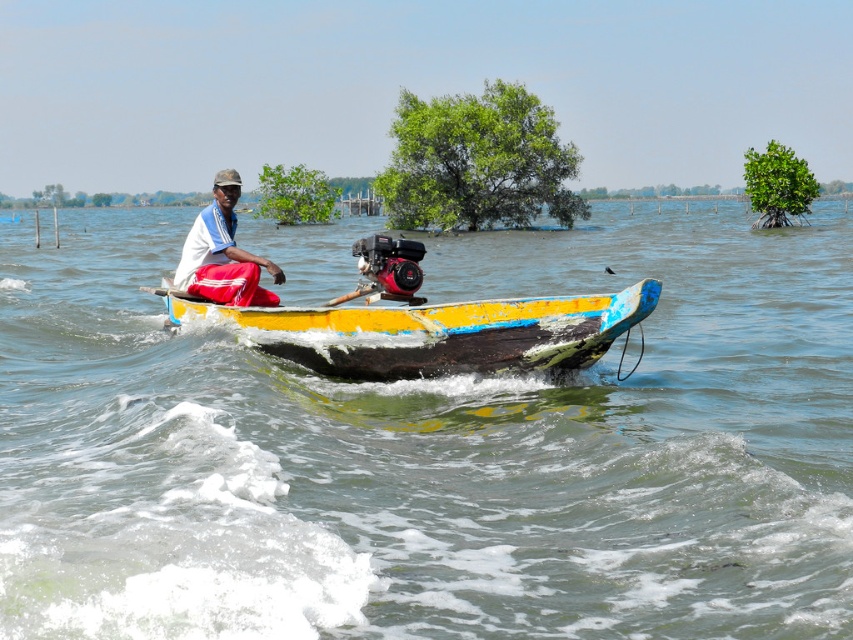
Question: Observing the image, what is the correct spatial positioning of clear water at boat front in reference to yellow painted wood canoe at center?

Choices:
 (A) above
 (B) below

Answer: (A)

Question: Does clear water at boat front have a lesser width compared to white fabric shirt at center?

Choices:
 (A) yes
 (B) no

Answer: (B)

Question: Which object is the closest to the white fabric shirt at center?

Choices:
 (A) yellow painted wood canoe at center
 (B) clear water at boat front

Answer: (A)

Question: Which point is farther from the camera taking this photo?

Choices:
 (A) (540, 624)
 (B) (560, 323)

Answer: (B)

Question: Which point is farther to the camera?

Choices:
 (A) white fabric shirt at center
 (B) clear water at boat front
 (C) yellow painted wood canoe at center

Answer: (A)

Question: Can you confirm if yellow painted wood canoe at center is positioned above white fabric shirt at center?

Choices:
 (A) yes
 (B) no

Answer: (B)